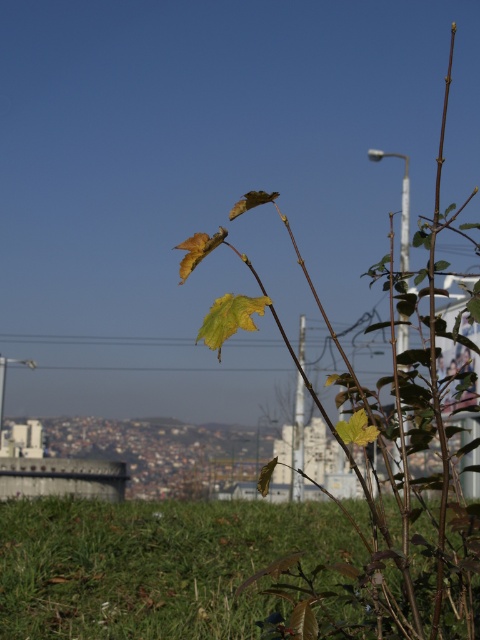
Between green grassy at lower left and green matte leaf at center, which one appears on the left side from the viewer's perspective?

From the viewer's perspective, green grassy at lower left appears more on the left side.

At what (x,y) coordinates should I click in order to perform the action: click on green grassy at lower left. Please return your answer as a coordinate pair (x, y). Looking at the image, I should click on (188, 570).

The width and height of the screenshot is (480, 640). Identify the location of green grassy at lower left. (188, 570).

Where is `green grassy at lower left`? The image size is (480, 640). green grassy at lower left is located at coordinates point(188,570).